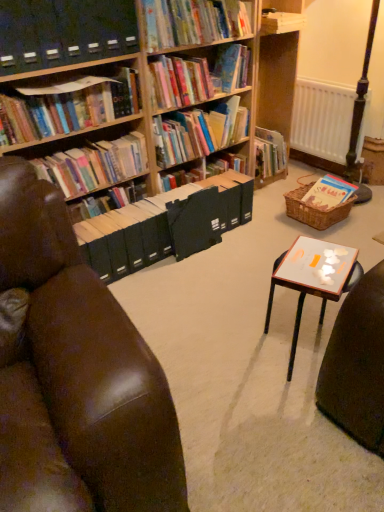
This screenshot has width=384, height=512. I want to click on free spot above white glossy table at center (from a real-world perspective), so click(x=312, y=263).